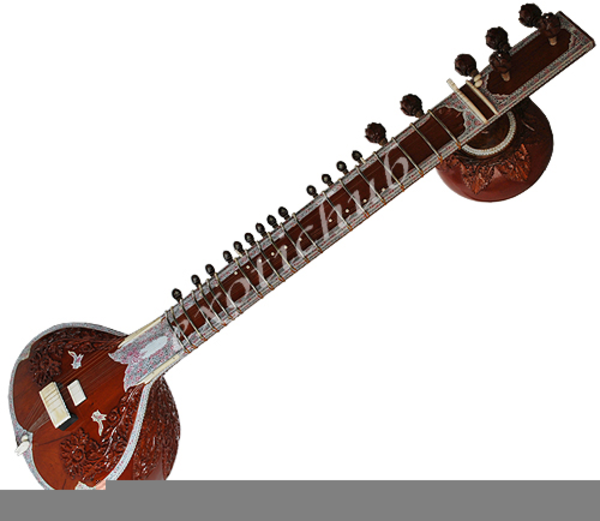
You are a GUI agent. You are given a task and a screenshot of the screen. Output one action in this format:
    pyautogui.click(x=<x>, y=<y>)
    Task: Click on the large knobs
    
    Given the screenshot: What is the action you would take?
    pyautogui.click(x=532, y=12), pyautogui.click(x=495, y=40), pyautogui.click(x=462, y=64), pyautogui.click(x=411, y=104), pyautogui.click(x=375, y=131)